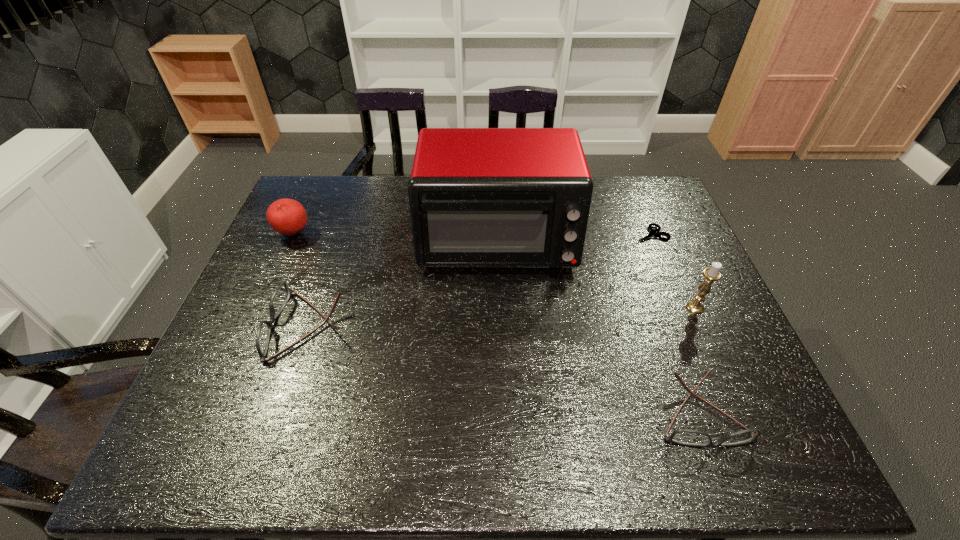
This screenshot has height=540, width=960. I want to click on shears that is at the right edge, so click(x=652, y=232).

Image resolution: width=960 pixels, height=540 pixels. What are the coordinates of `candle holder that is at the right edge` in the screenshot? It's located at (711, 274).

The image size is (960, 540). I want to click on object present at the near right corner, so click(x=688, y=437).

The width and height of the screenshot is (960, 540). I want to click on vacant space at the far edge, so click(395, 178).

In the image, there is a desktop. Find the location of `vacant space at the near edge`. vacant space at the near edge is located at coordinates (410, 396).

Locate an element on the screen. This screenshot has width=960, height=540. free space at the left edge of the desktop is located at coordinates (265, 309).

The width and height of the screenshot is (960, 540). In the image, there is a desktop. In order to click on vacant space at the right edge in this screenshot , I will do `click(703, 349)`.

Find the location of a particular element. The width and height of the screenshot is (960, 540). vacant space at the far left corner of the desktop is located at coordinates (299, 200).

This screenshot has width=960, height=540. What are the coordinates of `vacant region at the far right corner of the desktop` in the screenshot? It's located at (638, 186).

Image resolution: width=960 pixels, height=540 pixels. What are the coordinates of `free space between the fifth shortest object and the tallest object` in the screenshot? It's located at (596, 274).